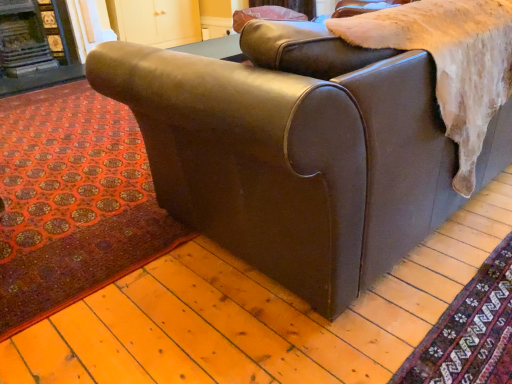
Question: Should I look upward or downward to see matte brown leather couch at center?

Choices:
 (A) up
 (B) down

Answer: (A)

Question: From the image's perspective, is carpeted floor at lower right, arranged as the second mat when viewed from the back, located beneath dark brown wood fireplace at upper left?

Choices:
 (A) no
 (B) yes

Answer: (B)

Question: Is carpeted floor at lower right, which ranks as the first mat in right-to-left order, bigger than dark brown wood fireplace at upper left?

Choices:
 (A) no
 (B) yes

Answer: (A)

Question: From the image's perspective, is carpeted floor at lower right, arranged as the first mat when viewed from the front, on top of dark brown wood fireplace at upper left?

Choices:
 (A) yes
 (B) no

Answer: (B)

Question: Does carpeted floor at lower right, which is counted as the 2th mat, starting from the left, have a greater height compared to dark brown wood fireplace at upper left?

Choices:
 (A) yes
 (B) no

Answer: (B)

Question: Is the position of carpeted floor at lower right, which ranks as the first mat in right-to-left order, less distant than that of dark brown wood fireplace at upper left?

Choices:
 (A) yes
 (B) no

Answer: (A)

Question: Is the position of carpeted floor at lower right, arranged as the second mat when viewed from the back, more distant than that of dark brown wood fireplace at upper left?

Choices:
 (A) yes
 (B) no

Answer: (B)

Question: Can you confirm if dark brown wood fireplace at upper left is shorter than matte brown leather couch at center?

Choices:
 (A) no
 (B) yes

Answer: (B)

Question: Does dark brown wood fireplace at upper left have a lesser width compared to matte brown leather couch at center?

Choices:
 (A) yes
 (B) no

Answer: (A)

Question: Is there a large distance between dark brown wood fireplace at upper left and matte brown leather couch at center?

Choices:
 (A) yes
 (B) no

Answer: (A)

Question: Does dark brown wood fireplace at upper left come behind matte brown leather couch at center?

Choices:
 (A) no
 (B) yes

Answer: (B)

Question: Is dark brown wood fireplace at upper left taller than matte brown leather couch at center?

Choices:
 (A) no
 (B) yes

Answer: (A)

Question: From a real-world perspective, is dark brown wood fireplace at upper left on matte brown leather couch at center?

Choices:
 (A) yes
 (B) no

Answer: (B)

Question: From a real-world perspective, is matte brown leather couch at center below red carpet at lower left, which is counted as the second mat, starting from the front?

Choices:
 (A) yes
 (B) no

Answer: (B)